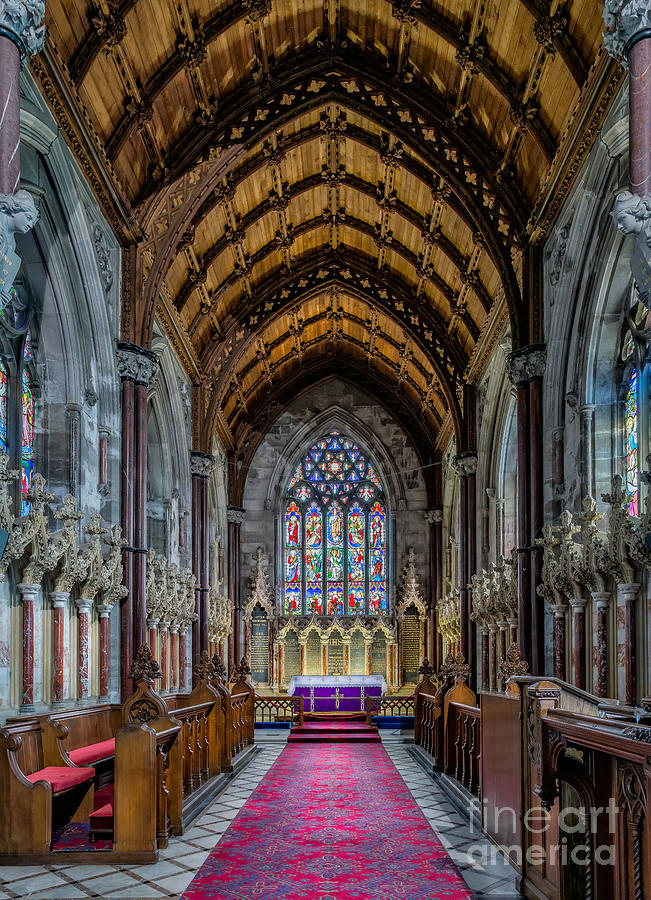
Identify the location of decorative arches on ceiling. (333, 88), (331, 274), (337, 371).